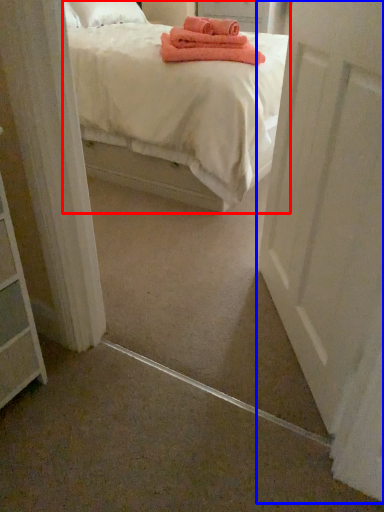
Question: Which object appears closest to the camera in this image, bed (highlighted by a red box) or door (highlighted by a blue box)?

Choices:
 (A) bed
 (B) door

Answer: (B)